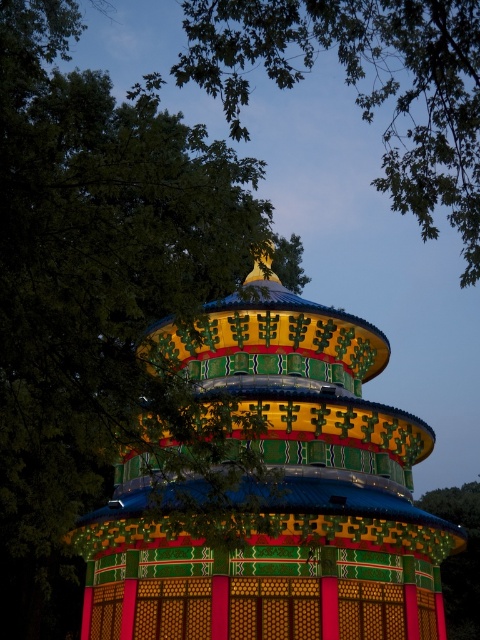
You are standing in a garden and want to take a photo of the multicolored painted pagoda at center without any obstructions. However, there is a green leafy tree at upper left in the way. Based on their heights, can you suggest a position where you can stand to capture the pagoda without the tree blocking it?

The green leafy tree at upper left is much taller than the multicolored painted pagoda at center. To avoid the tree blocking the view, you should position yourself lower or further back so that the shorter pagoda can be seen above the tree.

You are an architect analyzing the layout of the pavilion. You notice two trees in the image, the green leafy tree at upper left and the green textured tree at center. Which tree is positioned higher up in the image?

The green leafy tree at upper left is positioned higher up in the image than the green textured tree at center.